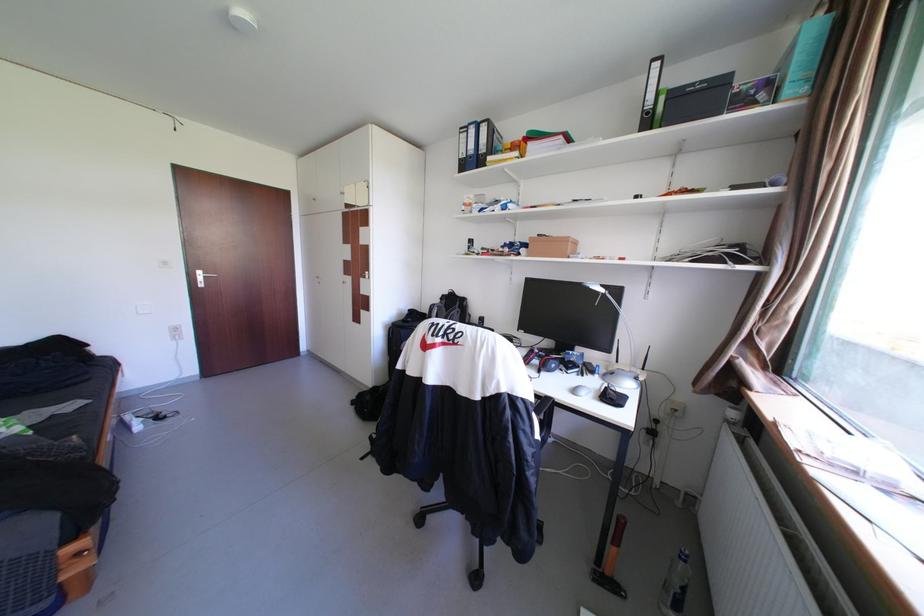
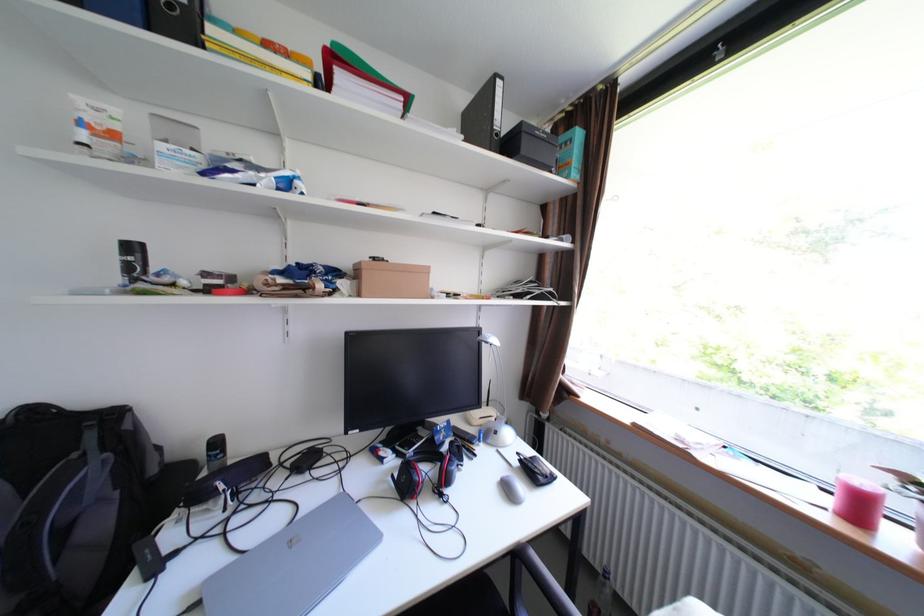
Find the pixel in the second image that matches the point at 481,241 in the first image.

(143, 248)